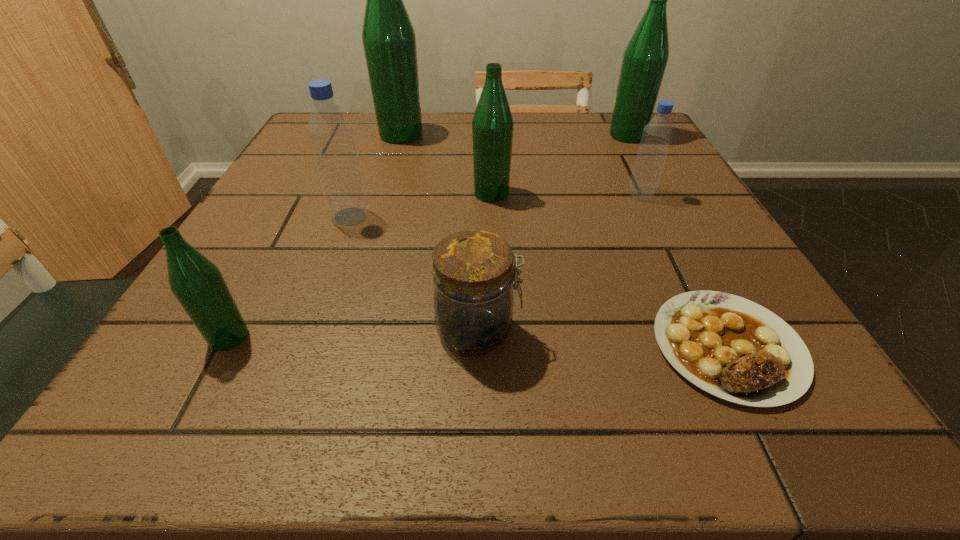
Find the location of a particular element. vacant space at the far left corner is located at coordinates (299, 156).

This screenshot has height=540, width=960. I want to click on vacant space at the far right corner, so click(600, 125).

Find the location of a particular element. vacant area between the second smallest green bottle and the left blue bottle is located at coordinates (421, 205).

Find the location of a particular element. The height and width of the screenshot is (540, 960). vacant area between the third smallest green bottle and the jar is located at coordinates (553, 233).

Identify the location of empty space between the second green bottle from right to left and the smallest green bottle. (360, 265).

Identify the location of free spot between the seventh tallest object and the bigger blue bottle. The width and height of the screenshot is (960, 540). (415, 274).

Locate an element on the screen. free space between the tallest object and the third biggest green bottle is located at coordinates (446, 164).

The height and width of the screenshot is (540, 960). What are the coordinates of `empty space between the nearer blue bottle and the steak` in the screenshot? It's located at (540, 282).

Where is `vacant area that lies between the left blue bottle and the nearest green bottle`? The width and height of the screenshot is (960, 540). vacant area that lies between the left blue bottle and the nearest green bottle is located at coordinates (290, 277).

The width and height of the screenshot is (960, 540). In order to click on empty location between the second green bottle from left to right and the jar in this screenshot , I will do `click(440, 233)`.